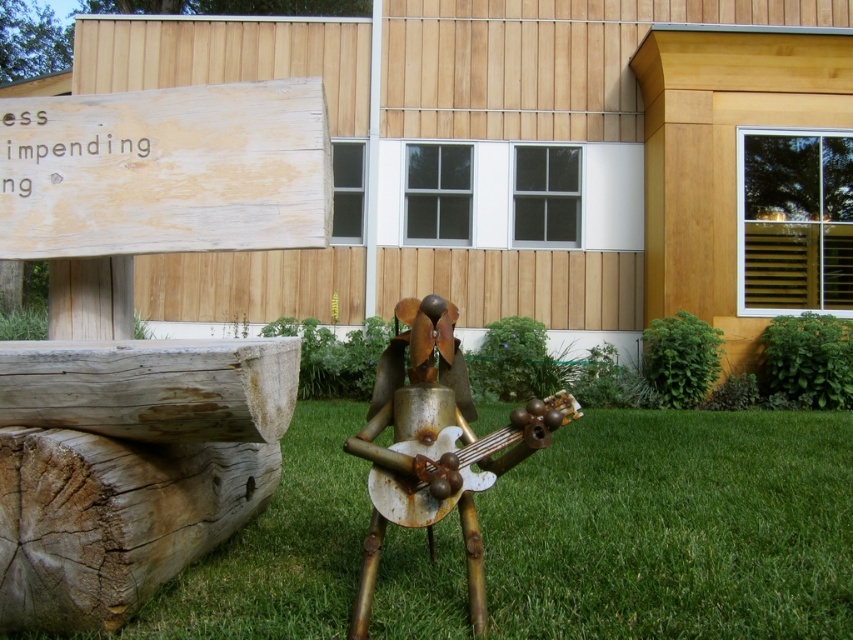
You are standing in front of the wooden building and see the green grass at center and the rusty metal guitar at center. Which object is located to the right of the other?

The green grass at center is positioned on the right side of rusty metal guitar at center, so the green grass at center is to the right of the rusty metal guitar at center.

You are standing on the green grass at center and want to walk towards the building. Is the rusty metal guitar at center blocking your path?

The rusty metal guitar at center is behind green grass at center, so it is not blocking your path to the building.

You are standing at the point marked as point (675,529) in the image. What do you see directly beneath your feet?

You see green grass at center directly beneath your feet at point (675,529).